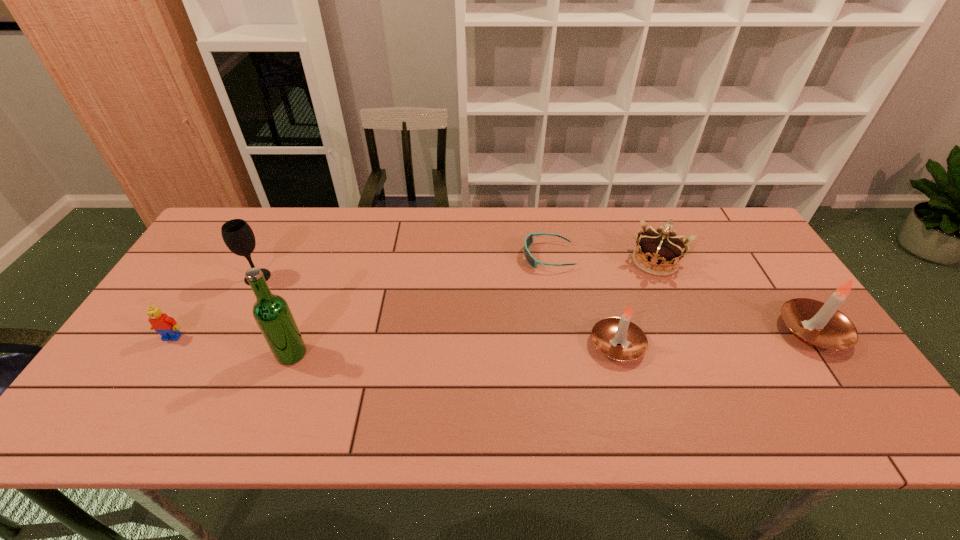
Please point a free position for a candle on the left. Please provide its 2D coordinates. Your answer should be formatted as a tuple, i.e. [(x, y)], where the tuple contains the x and y coordinates of a point satisfying the conditions above.

[(410, 359)]